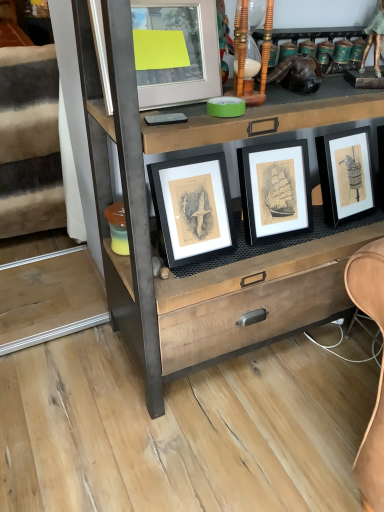
Question: From the image's perspective, would you say white fabric at left is shown under matte glass picture frame at upper center?

Choices:
 (A) yes
 (B) no

Answer: (B)

Question: Considering the relative sizes of white fabric at left and matte glass picture frame at upper center in the image provided, is white fabric at left smaller than matte glass picture frame at upper center?

Choices:
 (A) no
 (B) yes

Answer: (A)

Question: From a real-world perspective, is white fabric at left located beneath matte glass picture frame at upper center?

Choices:
 (A) no
 (B) yes

Answer: (B)

Question: Are white fabric at left and matte glass picture frame at upper center located far from each other?

Choices:
 (A) yes
 (B) no

Answer: (B)

Question: Is white fabric at left wider than matte glass picture frame at upper center?

Choices:
 (A) no
 (B) yes

Answer: (B)

Question: Is white fabric at left taller than matte glass picture frame at upper center?

Choices:
 (A) yes
 (B) no

Answer: (A)

Question: From the image's perspective, is wooden chest of drawers at center under white fabric at left?

Choices:
 (A) yes
 (B) no

Answer: (A)

Question: Does wooden chest of drawers at center have a lesser width compared to white fabric at left?

Choices:
 (A) yes
 (B) no

Answer: (A)

Question: Does wooden chest of drawers at center appear on the left side of white fabric at left?

Choices:
 (A) yes
 (B) no

Answer: (B)

Question: Is wooden chest of drawers at center smaller than white fabric at left?

Choices:
 (A) yes
 (B) no

Answer: (B)

Question: Is wooden chest of drawers at center positioned before white fabric at left?

Choices:
 (A) no
 (B) yes

Answer: (B)

Question: Considering the relative positions of wooden chest of drawers at center and white fabric at left in the image provided, is wooden chest of drawers at center behind white fabric at left?

Choices:
 (A) no
 (B) yes

Answer: (A)

Question: Is matte glass picture frame at upper center not within white fabric at left?

Choices:
 (A) no
 (B) yes

Answer: (B)